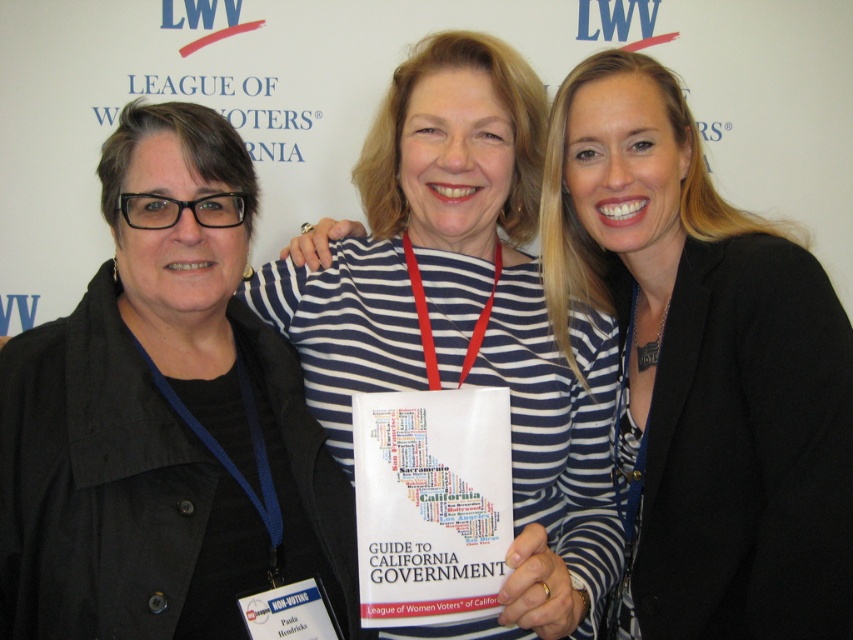
The height and width of the screenshot is (640, 853). In order to click on black matte jacket at left in this screenshot , I will do `click(165, 419)`.

How far apart are black matte jacket at left and striped fabric shirt at center?

black matte jacket at left is 22.87 inches from striped fabric shirt at center.

Does point (221, 260) come closer to viewer compared to point (708, 264)?

Yes.

At what (x,y) coordinates should I click in order to perform the action: click on black matte jacket at left. Please return your answer as a coordinate pair (x, y). Looking at the image, I should click on (165, 419).